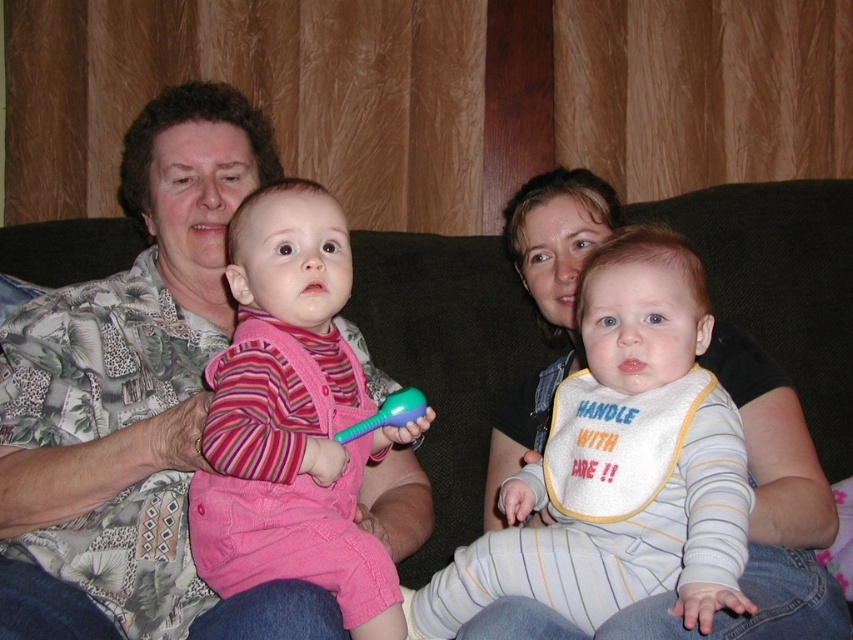
Question: Which is farther from the pink corduroy overalls at center?

Choices:
 (A) printed fabric shirt at left
 (B) white striped bib at center

Answer: (B)

Question: Among these objects, which one is farthest from the camera?

Choices:
 (A) white striped bib at center
 (B) printed fabric shirt at left
 (C) pink corduroy overalls at center

Answer: (C)

Question: Can you confirm if printed fabric shirt at left is positioned to the left of pink corduroy overalls at center?

Choices:
 (A) no
 (B) yes

Answer: (B)

Question: Which point appears farthest from the camera in this image?

Choices:
 (A) 267,220
 (B) 144,342

Answer: (B)

Question: Is white striped bib at center wider than pink corduroy overalls at center?

Choices:
 (A) yes
 (B) no

Answer: (A)

Question: Does white striped bib at center appear on the left side of pink corduroy overalls at center?

Choices:
 (A) yes
 (B) no

Answer: (B)